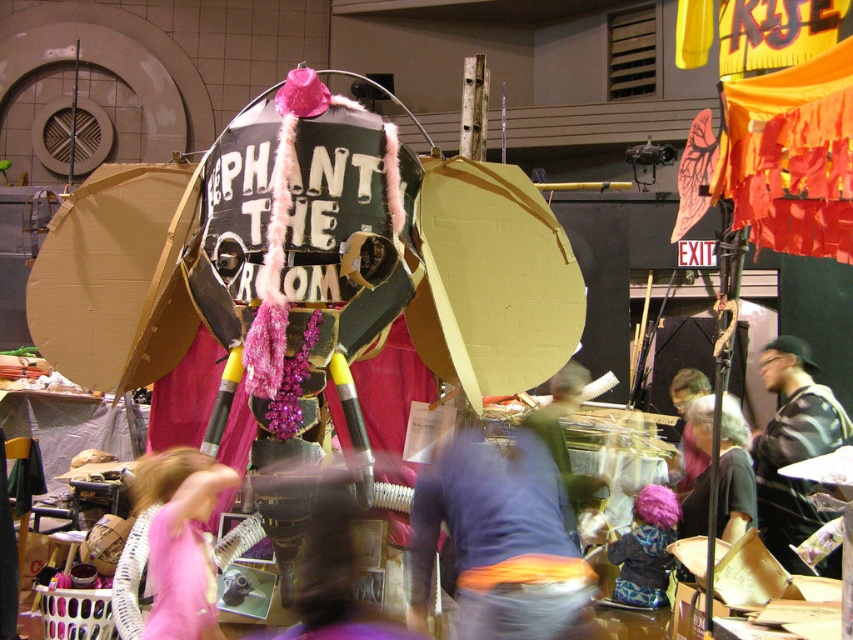
You are standing in the creative space and notice an orange fabric belt at center and a pink fabric dress at center. Which item is nearer to you?

The orange fabric belt at center is closer to the viewer than the pink fabric dress at center.

Based on the photo, you are an interior designer observing the artwork in the room. You notice two wigs at the center of the scene. Which wig is positioned lower between the gray fabric wig at center and the matte pink wig at center?

The gray fabric wig at center is located below the matte pink wig at center, so it is positioned lower.